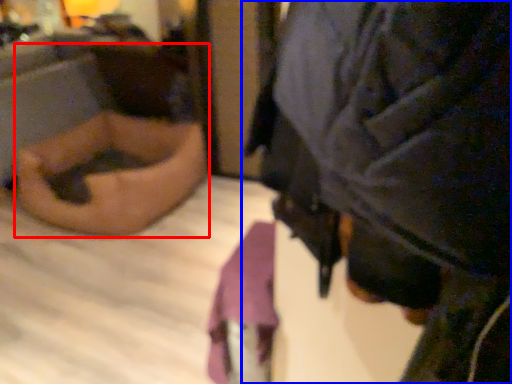
Question: Which point is further to the camera, person (highlighted by a red box) or person (highlighted by a blue box)?

Choices:
 (A) person
 (B) person

Answer: (A)